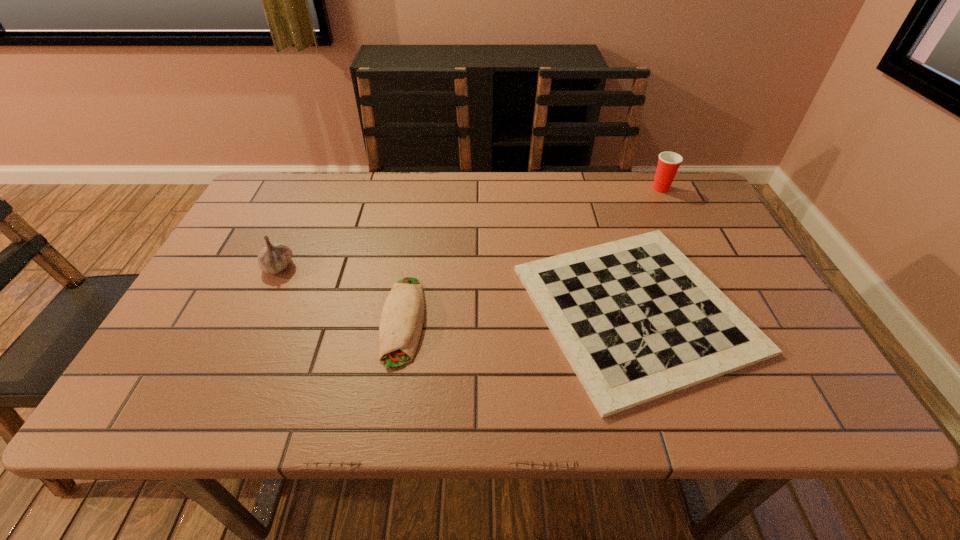
Find the location of a particular element. Image resolution: width=960 pixels, height=540 pixels. vacant space at the near right corner of the desktop is located at coordinates (749, 401).

Find the location of `empty space that is in between the farthest object and the second shortest object`. empty space that is in between the farthest object and the second shortest object is located at coordinates (532, 254).

Locate an element on the screen. unoccupied position between the farthest object and the second shortest object is located at coordinates (532, 254).

Find the location of a particular element. Image resolution: width=960 pixels, height=540 pixels. free space between the Dixie cup and the garlic is located at coordinates (469, 227).

Locate an element on the screen. This screenshot has height=540, width=960. vacant point located between the farthest object and the garlic is located at coordinates (469, 227).

Identify the location of free space between the Dixie cup and the burrito. (532, 254).

Locate an element on the screen. The width and height of the screenshot is (960, 540). free space that is in between the Dixie cup and the third tallest object is located at coordinates (532, 254).

Where is `vacant point located between the farthest object and the leftmost object`? This screenshot has height=540, width=960. vacant point located between the farthest object and the leftmost object is located at coordinates (469, 227).

Where is `free space between the shortest object and the third tallest object`? This screenshot has width=960, height=540. free space between the shortest object and the third tallest object is located at coordinates (519, 314).

Locate an element on the screen. The width and height of the screenshot is (960, 540). free space between the leftmost object and the farthest object is located at coordinates [x=469, y=227].